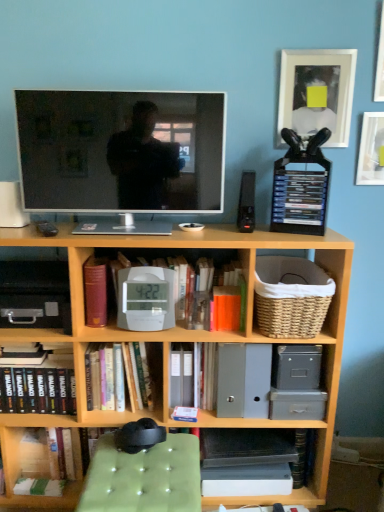
What do you see at coordinates (291, 296) in the screenshot? This screenshot has height=512, width=384. I see `woven straw basket at right` at bounding box center [291, 296].

Locate an element on the screen. This screenshot has width=384, height=512. matte black tv at center is located at coordinates (121, 151).

Identify the location of hardcover book at lower left, the third book positioned from the right. The width and height of the screenshot is (384, 512). (40, 385).

Locate an element on the screen. This screenshot has width=384, height=512. maroon leather book at center-left, which is the first paperback book from left to right is located at coordinates (95, 291).

You are a GUI agent. You are given a task and a screenshot of the screen. Output one action in this format:
    pyautogui.click(x=<x>, y=<y>)
    Task: Click on the white glossy picture frame at upper right, placed as the third picture frame when sorted from right to left
    
    Given the screenshot: What is the action you would take?
    point(320,88)

From their relative heights in the image, would you say white plastic alarm clock at center is taller or shorter than hardcover book at center, which ranks as the second book in right-to-left order?

white plastic alarm clock at center is shorter than hardcover book at center, which ranks as the second book in right-to-left order.

Which is more to the right, white plastic alarm clock at center or hardcover book at center, arranged as the 2th book when viewed from the left?

white plastic alarm clock at center.

Which of these two, white plastic alarm clock at center or hardcover book at center, which ranks as the second book in right-to-left order, is thinner?

white plastic alarm clock at center.

Is white plastic alarm clock at center inside or outside of hardcover book at center, which ranks as the second book in right-to-left order?

white plastic alarm clock at center is outside hardcover book at center, which ranks as the second book in right-to-left order.

Is green fabric ottoman at lower center smaller than matte black tv at center?

Yes, green fabric ottoman at lower center is smaller than matte black tv at center.

Consider the image. Based on their positions, is green fabric ottoman at lower center located to the left or right of matte black tv at center?

From the image, it's evident that green fabric ottoman at lower center is to the right of matte black tv at center.

How distant is green fabric ottoman at lower center from matte black tv at center?

green fabric ottoman at lower center is 37.68 inches from matte black tv at center.

Where is `television on the left of green fabric ottoman at lower center`? The image size is (384, 512). television on the left of green fabric ottoman at lower center is located at coordinates (121, 151).

Are wooden bookcase at center and black plastic speaker at upper right located far from each other?

That's not correct — wooden bookcase at center is a little close to black plastic speaker at upper right.

Considering the points (348, 293) and (242, 218), which point is behind, point (348, 293) or point (242, 218)?

The point (348, 293) is farther.

From a real-world perspective, relative to black plastic speaker at upper right, is wooden bookcase at center vertically above or below?

From a real-world perspective, wooden bookcase at center is physically below black plastic speaker at upper right.

Identify the location of bookcase below the black plastic speaker at upper right (from the image's perspective). pos(180,341).

Which object is positioned more to the left, hardcover book at lower left, arranged as the first book when viewed from the left, or matte black tv at center?

hardcover book at lower left, arranged as the first book when viewed from the left, is more to the left.

Is hardcover book at lower left, arranged as the first book when viewed from the left, aimed at matte black tv at center?

No, hardcover book at lower left, arranged as the first book when viewed from the left, is not oriented towards matte black tv at center.

Image resolution: width=384 pixels, height=512 pixels. Identify the location of television that is above the hardcover book at lower left, the third book positioned from the right (from the image's perspective). (121, 151).

Looking at this image, considering the sizes of objects hardcover book at lower left, arranged as the first book when viewed from the left, and matte black tv at center in the image provided, who is bigger, hardcover book at lower left, arranged as the first book when viewed from the left, or matte black tv at center?

matte black tv at center.

Between hardcover book at lower left, arranged as the first book when viewed from the left, and white plastic alarm clock at center, which one has more height?

With more height is white plastic alarm clock at center.

Visually, is hardcover book at lower left, the third book positioned from the right, positioned to the left or to the right of white plastic alarm clock at center?

From the image, it's evident that hardcover book at lower left, the third book positioned from the right, is to the left of white plastic alarm clock at center.

Which of these two, hardcover book at lower left, arranged as the first book when viewed from the left, or white plastic alarm clock at center, is bigger?

Bigger between the two is hardcover book at lower left, arranged as the first book when viewed from the left.

Could you measure the distance between hardcover book at lower left, arranged as the first book when viewed from the left, and white plastic alarm clock at center?

The distance of hardcover book at lower left, arranged as the first book when viewed from the left, from white plastic alarm clock at center is 15.44 inches.

Is woven straw basket at right facing away from green fabric ottoman at lower center?

No, green fabric ottoman at lower center is not at the back of woven straw basket at right.

Is green fabric ottoman at lower center inside woven straw basket at right?

Actually, green fabric ottoman at lower center is outside woven straw basket at right.

Considering the sizes of objects woven straw basket at right and green fabric ottoman at lower center in the image provided, who is smaller, woven straw basket at right or green fabric ottoman at lower center?

woven straw basket at right is smaller.

What's the angular difference between white plastic clock at center, which is the 3th book in left-to-right order, and white plastic alarm clock at center's facing directions?

The angular difference between white plastic clock at center, which is the 3th book in left-to-right order, and white plastic alarm clock at center is 1.7 degrees.

Does white plastic clock at center, marked as the 1th book in a right-to-left arrangement, have a greater height compared to white plastic alarm clock at center?

Result: Yes.

Does white plastic clock at center, which is the 3th book in left-to-right order, come in front of white plastic alarm clock at center?

No.

Based on the photo, is white plastic clock at center, marked as the 1th book in a right-to-left arrangement, not inside white plastic alarm clock at center?

white plastic clock at center, marked as the 1th book in a right-to-left arrangement, is positioned outside white plastic alarm clock at center.

Find the location of a particular element. alarm clock that appears on the right of hardcover book at center, arranged as the 2th book when viewed from the left is located at coordinates (146, 298).

Where is `swivel chair below the matte black tv at center (from the image's perspective)`? This screenshot has width=384, height=512. swivel chair below the matte black tv at center (from the image's perspective) is located at coordinates (144, 477).

Which object lies further to the anchor point white glossy picture frame at upper right, placed as the 1th picture frame when sorted from left to right, matte white picture frame at upper right, the third picture frame positioned from the left, or green fabric ottoman at lower center?

green fabric ottoman at lower center.

From the image, which object appears to be nearer to black plastic speaker at upper right, hardcover book at center, which ranks as the second book in right-to-left order, or matte black tv at center?

Based on the image, matte black tv at center appears to be nearer to black plastic speaker at upper right.

Estimate the real-world distances between objects in this image. Which object is closer to white plastic alarm clock at center, black plastic speaker at upper right or matte white picture frame at upper right, the third picture frame positioned from the left?

black plastic speaker at upper right.

Based on the photo, based on their spatial positions, is white matte picture frame at upper right, which appears as the second picture frame when viewed from the left, or white plastic clock at center, marked as the 1th book in a right-to-left arrangement, further from matte black tv at center?

The object further to matte black tv at center is white matte picture frame at upper right, which appears as the second picture frame when viewed from the left.

When comparing their distances from white matte picture frame at upper right, which appears as the second picture frame when viewed from the left, does white plastic alarm clock at center or hardcover book at center, arranged as the 2th book when viewed from the left, seem closer?

white plastic alarm clock at center.

Based on their spatial positions, is matte white picture frame at upper right, the third picture frame positioned from the left, or maroon leather book at center-left, the 2th paperback book in the right-to-left sequence, further from black plastic drawer at left?

Based on the image, matte white picture frame at upper right, the third picture frame positioned from the left, appears to be further to black plastic drawer at left.

Which object lies further to the anchor point black plastic speaker at upper right, maroon leather book at center-left, which is the first paperback book from left to right, or hardcover book at center, arranged as the 2th book when viewed from the left?

Based on the image, hardcover book at center, arranged as the 2th book when viewed from the left, appears to be further to black plastic speaker at upper right.

Looking at the image, which one is located closer to hardcover book at lower left, the third book positioned from the right, white glossy picture frame at upper right, placed as the 1th picture frame when sorted from left to right, or orange matte paperback book at center, which is counted as the first paperback book, starting from the right?

orange matte paperback book at center, which is counted as the first paperback book, starting from the right, is closer to hardcover book at lower left, the third book positioned from the right.

Locate an element on the screen. television between hardcover book at center, which ranks as the second book in right-to-left order, and white matte picture frame at upper right, which appears as the second picture frame when viewed from the left is located at coordinates (121, 151).

You are a GUI agent. You are given a task and a screenshot of the screen. Output one action in this format:
    pyautogui.click(x=<x>, y=<y>)
    Task: Click on the basket between white matte picture frame at upper right, which appears as the second picture frame when viewed from the left, and orange matte paperback book at center, which is counted as the first paperback book, starting from the right, in the up-down direction
    The image size is (384, 512).
    Given the screenshot: What is the action you would take?
    pyautogui.click(x=291, y=296)

The height and width of the screenshot is (512, 384). In order to click on bookcase that lies between white glossy picture frame at upper right, placed as the 1th picture frame when sorted from left to right, and hardcover book at lower left, arranged as the first book when viewed from the left, from top to bottom in this screenshot , I will do `click(180, 341)`.

What are the coordinates of `alarm clock between matte black tv at center and matte white picture frame at upper right, the third picture frame positioned from the left` in the screenshot? It's located at (146, 298).